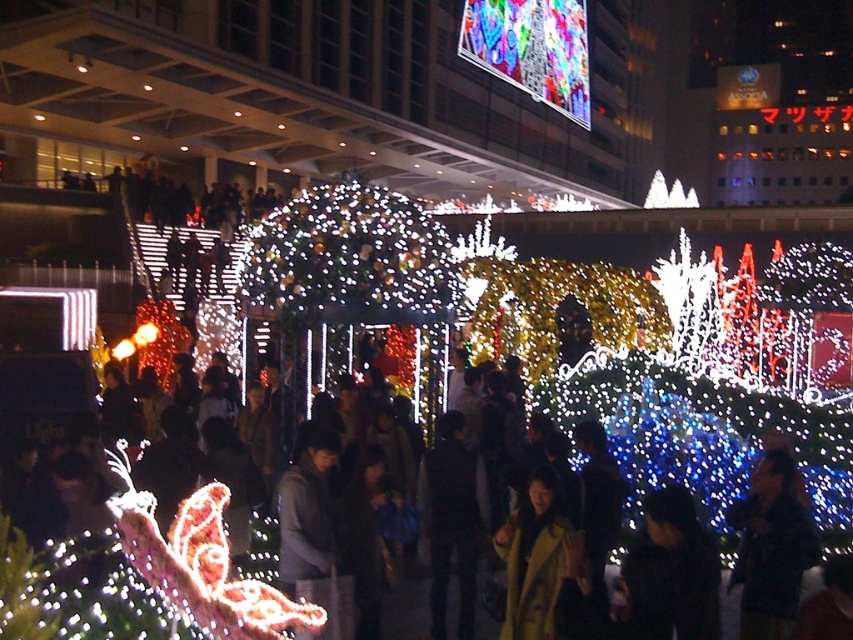
Is matte white lights at center to the left of dark blue fabric jacket at lower right from the viewer's perspective?

Indeed, matte white lights at center is positioned on the left side of dark blue fabric jacket at lower right.

Is matte white lights at center taller than dark blue fabric jacket at lower right?

Indeed, matte white lights at center has a greater height compared to dark blue fabric jacket at lower right.

This screenshot has height=640, width=853. What are the coordinates of `matte white lights at center` in the screenshot? It's located at (706, 440).

Locate an element on the screen. The width and height of the screenshot is (853, 640). matte white lights at center is located at coordinates (706, 440).

Does point (755, 602) come closer to viewer compared to point (553, 484)?

That is True.

Who is more distant from viewer, (x=746, y=600) or (x=544, y=540)?

The point (x=746, y=600) is behind.

What do you see at coordinates (770, 547) in the screenshot? The width and height of the screenshot is (853, 640). I see `dark blue fabric jacket at lower right` at bounding box center [770, 547].

Identify the location of dark blue fabric jacket at lower right. (770, 547).

Is point (656, 468) farther from camera compared to point (537, 509)?

Yes, it is.

Measure the distance between matte white lights at center and yellow matte coat at center.

matte white lights at center and yellow matte coat at center are 20.34 feet apart.

Measure the distance between point (64, 545) and camera.

They are 26.77 meters apart.

I want to click on matte white lights at center, so click(x=706, y=440).